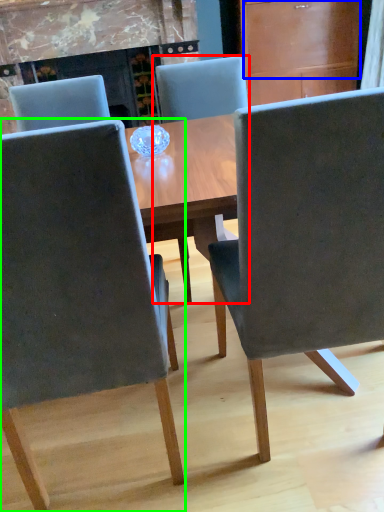
Question: Based on their relative distances, which object is farther from chair (highlighted by a red box)? Choose from drawer (highlighted by a blue box) and chair (highlighted by a green box).

Choices:
 (A) drawer
 (B) chair

Answer: (A)